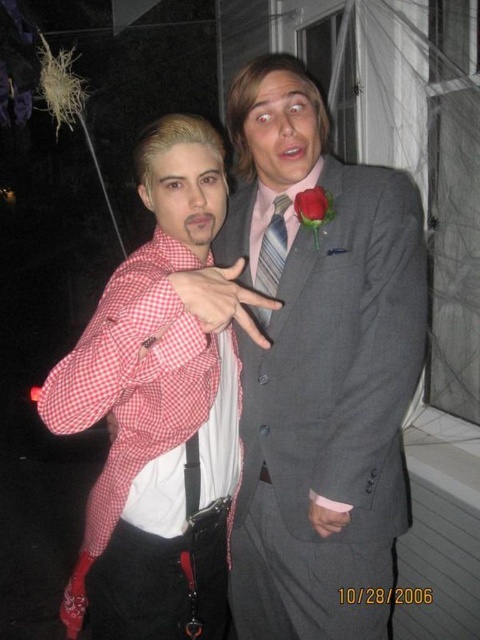
Question: Estimate the real-world distances between objects in this image. Which object is closer to the red velvet rose at upper center?

Choices:
 (A) checkered fabric shirt at left
 (B) pink striped tie at center
 (C) matte gray suit at center

Answer: (B)

Question: Estimate the real-world distances between objects in this image. Which object is farther from the red velvet rose at upper center?

Choices:
 (A) matte gray suit at center
 (B) pink striped tie at center

Answer: (A)

Question: Which point appears closest to the camera in this image?

Choices:
 (A) pos(272,250)
 (B) pos(326,218)
 (C) pos(335,314)

Answer: (B)

Question: Does matte gray suit at center have a smaller size compared to red velvet rose at upper center?

Choices:
 (A) yes
 (B) no

Answer: (B)

Question: Does pink striped tie at center appear over red velvet rose at upper center?

Choices:
 (A) no
 (B) yes

Answer: (A)

Question: Does matte gray suit at center have a greater width compared to pink striped tie at center?

Choices:
 (A) no
 (B) yes

Answer: (B)